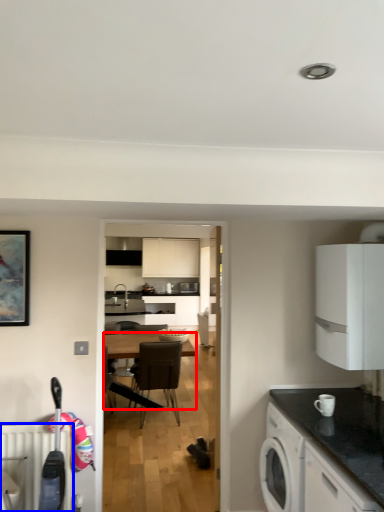
Question: Which object is further to the camera taking this photo, desk (highlighted by a red box) or radiator (highlighted by a blue box)?

Choices:
 (A) desk
 (B) radiator

Answer: (A)